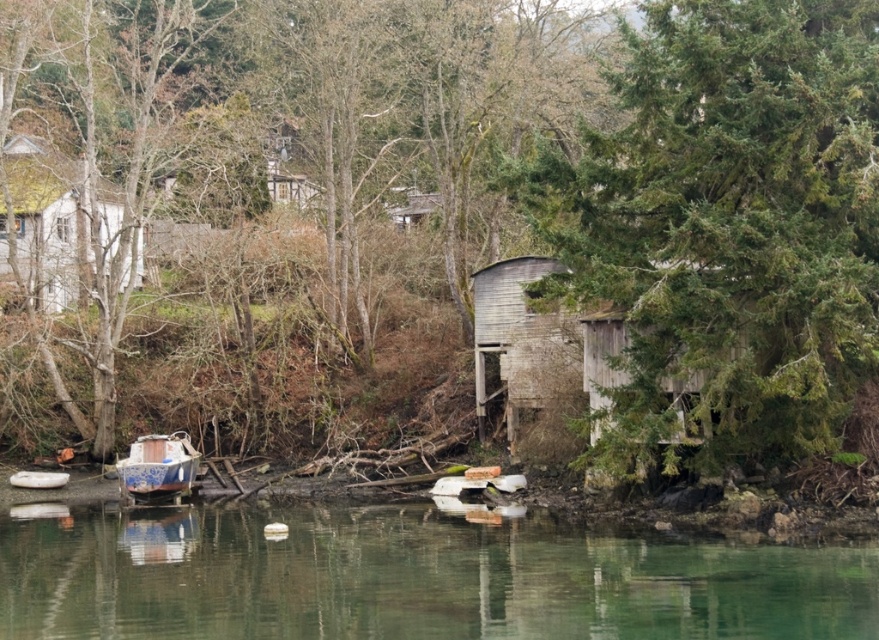
How distant is green textured tree at center from blue painted wood boat at lower left?

They are 56.06 feet apart.

Who is taller, green textured tree at center or blue painted wood boat at lower left?

With more height is green textured tree at center.

Does point (781, 74) come behind point (172, 467)?

That is False.

This screenshot has width=879, height=640. Find the location of `green textured tree at center`. green textured tree at center is located at coordinates (729, 224).

Between point (674, 573) and point (144, 483), which one is positioned behind?

The point (144, 483) is more distant.

From the picture: Is clear water at lower center behind blue painted wood boat at lower left?

No, it is in front of blue painted wood boat at lower left.

Does point (449, 550) come farther from viewer compared to point (189, 470)?

No, (449, 550) is in front of (189, 470).

This screenshot has height=640, width=879. Identify the location of clear water at lower center. (413, 579).

Identify the location of weathered wood hut at center-right. This screenshot has width=879, height=640. (539, 342).

Based on the photo, can you confirm if weathered wood hut at center-right is thinner than blue painted wood boat at lower left?

In fact, weathered wood hut at center-right might be wider than blue painted wood boat at lower left.

Is point (601, 321) in front of point (133, 460)?

Yes.

Identify the location of weathered wood hut at center-right. (539, 342).